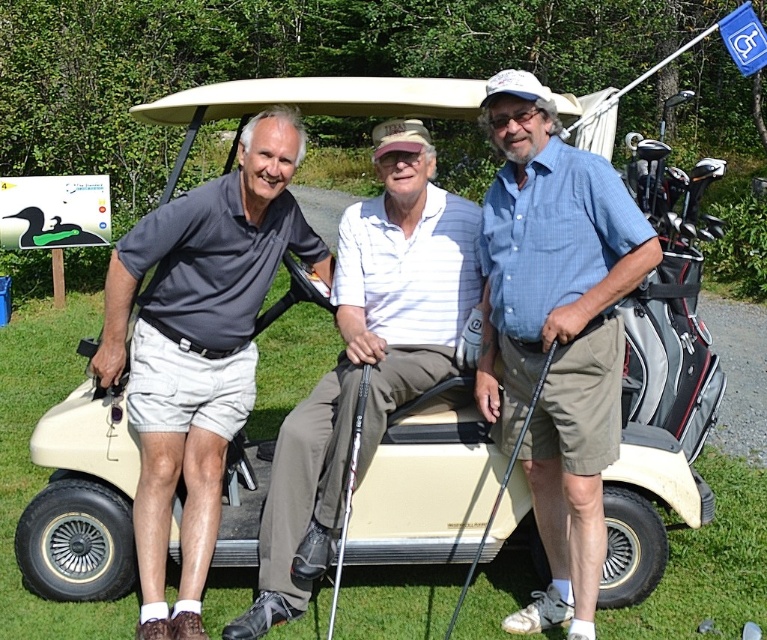
Question: Which point is farther from the camera taking this photo?

Choices:
 (A) (509, 193)
 (B) (344, 529)
 (C) (528, 419)

Answer: (B)

Question: Is silver metallic golf club at center smaller than black metallic golf club at center?

Choices:
 (A) yes
 (B) no

Answer: (A)

Question: Which point is closer to the camera?

Choices:
 (A) silver metallic golf club at center
 (B) blue plaid shirt at center
 (C) dark gray cotton polo shirt at left

Answer: (B)

Question: Is the position of dark gray cotton polo shirt at left less distant than that of black metallic golf club at center?

Choices:
 (A) yes
 (B) no

Answer: (B)

Question: Is blue plaid shirt at center bigger than black metallic golf club at center?

Choices:
 (A) yes
 (B) no

Answer: (A)

Question: Considering the real-world distances, which object is farthest from the black metallic golf club at center?

Choices:
 (A) dark gray cotton polo shirt at left
 (B) white striped polo shirt at center

Answer: (A)